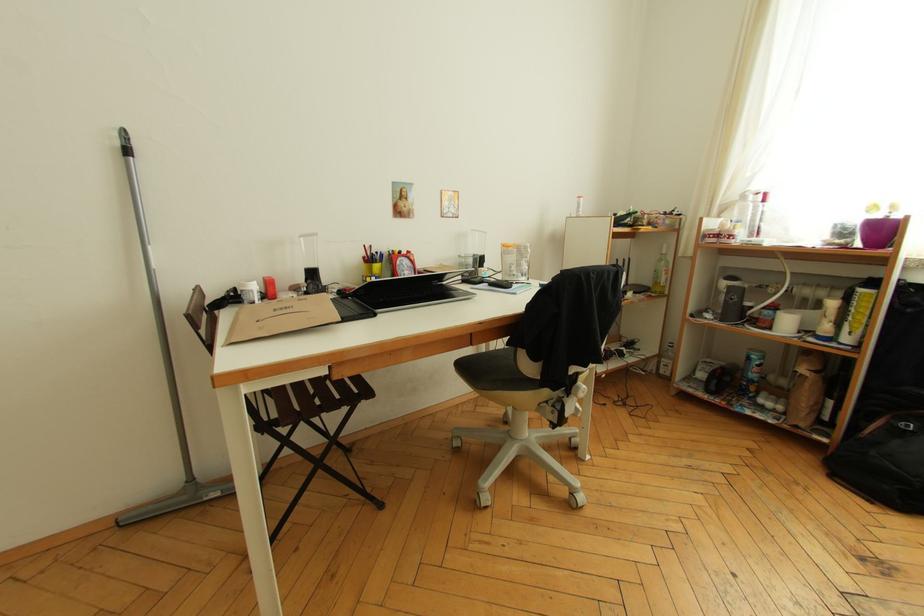
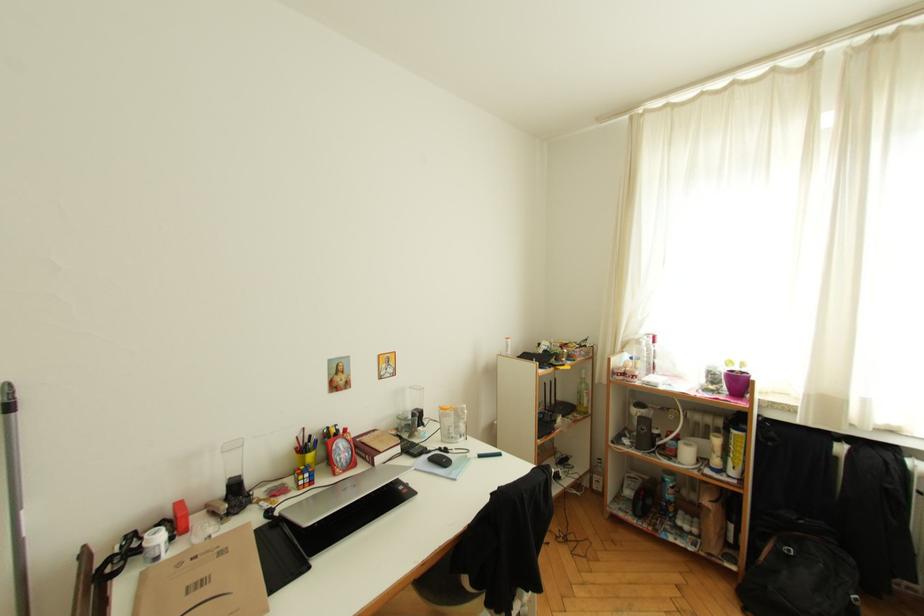
Question: The first image is from the beginning of the video and the second image is from the end. How did the camera likely rotate when shooting the video?

Choices:
 (A) Left
 (B) Right
 (C) Up
 (D) Down

Answer: (B)